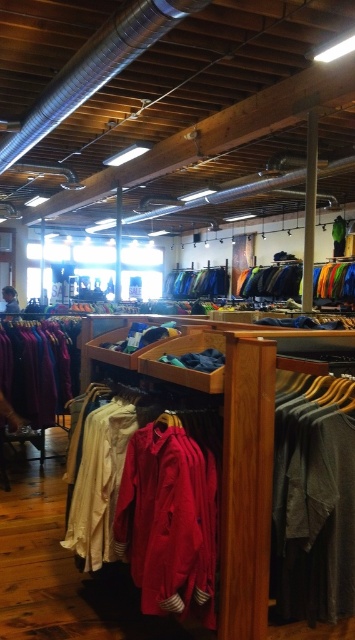
Question: Where is matte red shirt at center located in relation to velvet purple sweater at left in the image?

Choices:
 (A) right
 (B) left

Answer: (A)

Question: Considering the real-world distances, which object is closest to the matte red shirt at center?

Choices:
 (A) dark gray fabric shirt at center
 (B) velvet purple sweater at left
 (C) blue fabric pants at center

Answer: (A)

Question: Does velvet purple sweater at left have a larger size compared to blue fabric pants at center?

Choices:
 (A) yes
 (B) no

Answer: (B)

Question: Does dark gray fabric shirt at center lie in front of velvet purple sweater at left?

Choices:
 (A) no
 (B) yes

Answer: (B)

Question: Which point is closer to the camera?

Choices:
 (A) (24, 403)
 (B) (313, 378)
 (C) (176, 461)
 (D) (168, 291)

Answer: (C)

Question: Which is farther from the dark gray fabric shirt at center?

Choices:
 (A) velvet purple sweater at left
 (B) blue fabric pants at center
 (C) matte red shirt at center

Answer: (B)